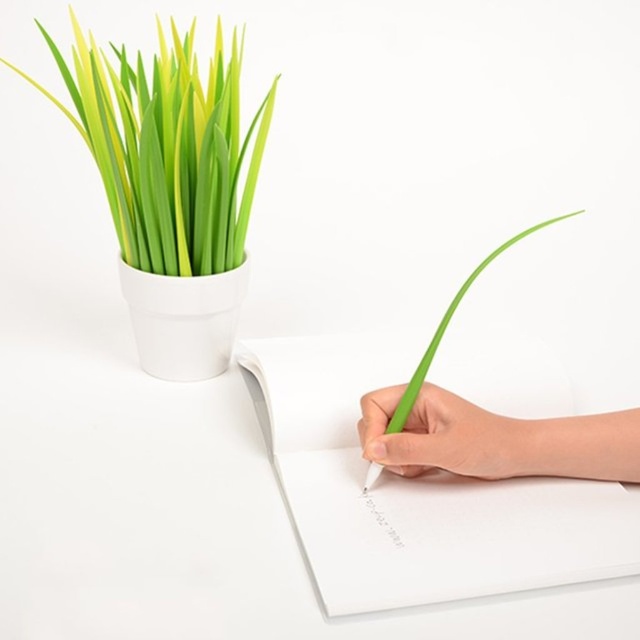
Question: Considering the relative positions of white paper at center and green matte grass at upper left in the image provided, where is white paper at center located with respect to green matte grass at upper left?

Choices:
 (A) right
 (B) left

Answer: (A)

Question: Which object is closer to the camera taking this photo?

Choices:
 (A) green matte pen at lower right
 (B) green matte grass at upper left

Answer: (B)

Question: Among these points, which one is farthest from the camera?

Choices:
 (A) (413, 419)
 (B) (118, 56)
 (C) (342, 381)

Answer: (B)

Question: Does green matte grass at upper left have a smaller size compared to green matte pen at lower right?

Choices:
 (A) no
 (B) yes

Answer: (A)

Question: Which point is closer to the camera taking this photo?

Choices:
 (A) (129, 134)
 (B) (428, 387)
 (C) (474, 371)

Answer: (B)

Question: Considering the relative positions of green matte grass at upper left and green matte pen at lower right in the image provided, where is green matte grass at upper left located with respect to green matte pen at lower right?

Choices:
 (A) above
 (B) below

Answer: (A)